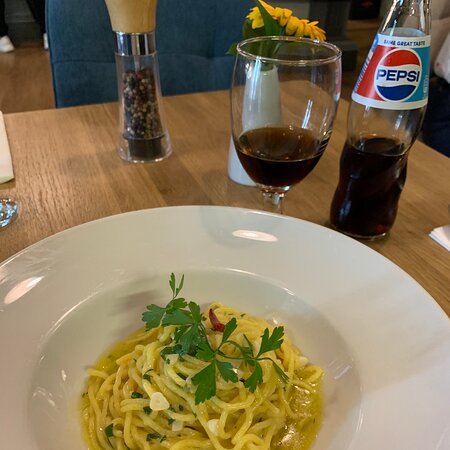
Find the location of a particular element. 2 napkins is located at coordinates (441, 245), (0, 155).